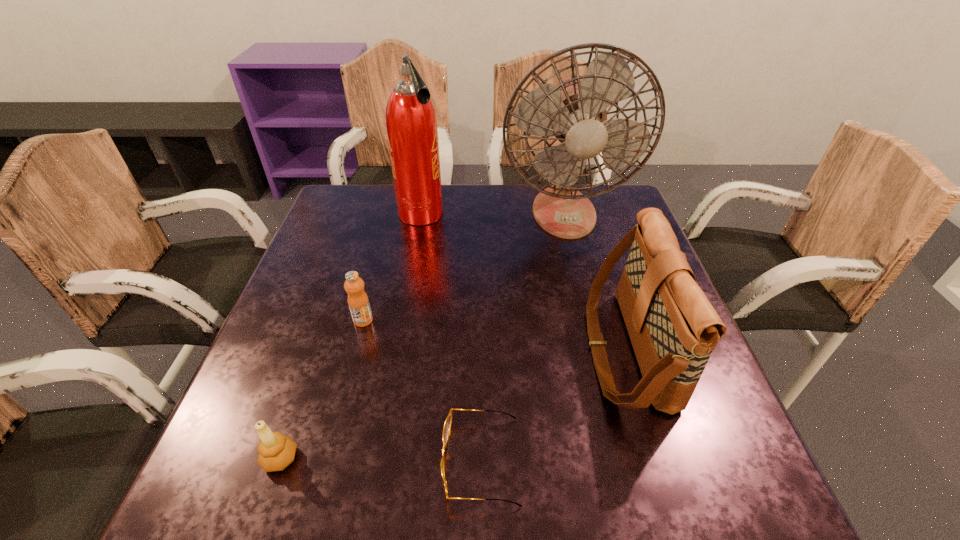
Locate an element on the screen. This screenshot has height=540, width=960. spectacles that is at the near edge is located at coordinates (448, 422).

The height and width of the screenshot is (540, 960). I want to click on object located in the left edge section of the desktop, so click(276, 451).

Image resolution: width=960 pixels, height=540 pixels. What are the coordinates of `fan present at the right edge` in the screenshot? It's located at (574, 111).

Locate an element on the screen. Image resolution: width=960 pixels, height=540 pixels. shoulder bag present at the right edge is located at coordinates (673, 328).

Image resolution: width=960 pixels, height=540 pixels. In order to click on object located at the near left corner in this screenshot , I will do `click(276, 451)`.

Image resolution: width=960 pixels, height=540 pixels. I want to click on object present at the far right corner, so click(574, 111).

Image resolution: width=960 pixels, height=540 pixels. What are the coordinates of `vacant space at the far edge of the desktop` in the screenshot? It's located at (502, 206).

In the image, there is a desktop. Where is `vacant space at the near edge`? The height and width of the screenshot is (540, 960). vacant space at the near edge is located at coordinates (441, 482).

Locate an element on the screen. vacant space at the left edge is located at coordinates (334, 262).

In the image, there is a desktop. In order to click on free region at the right edge in this screenshot , I will do `click(696, 414)`.